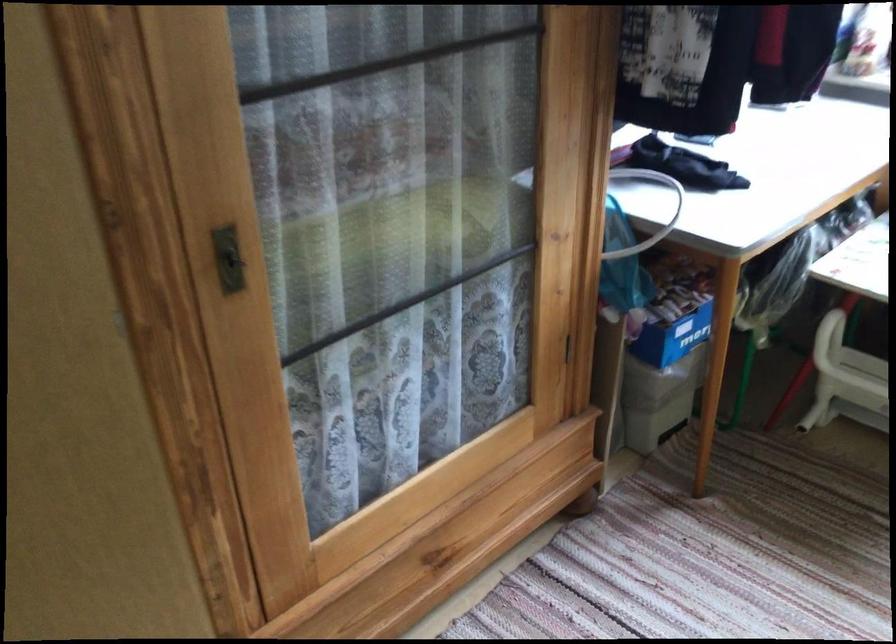
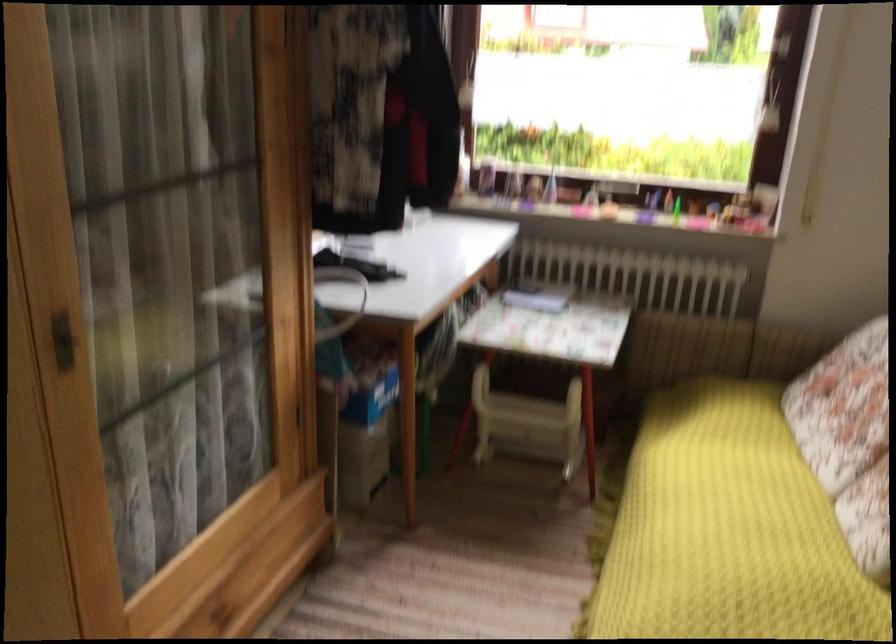
Find the pixel in the second image that matches point (240, 257) in the first image.

(63, 341)